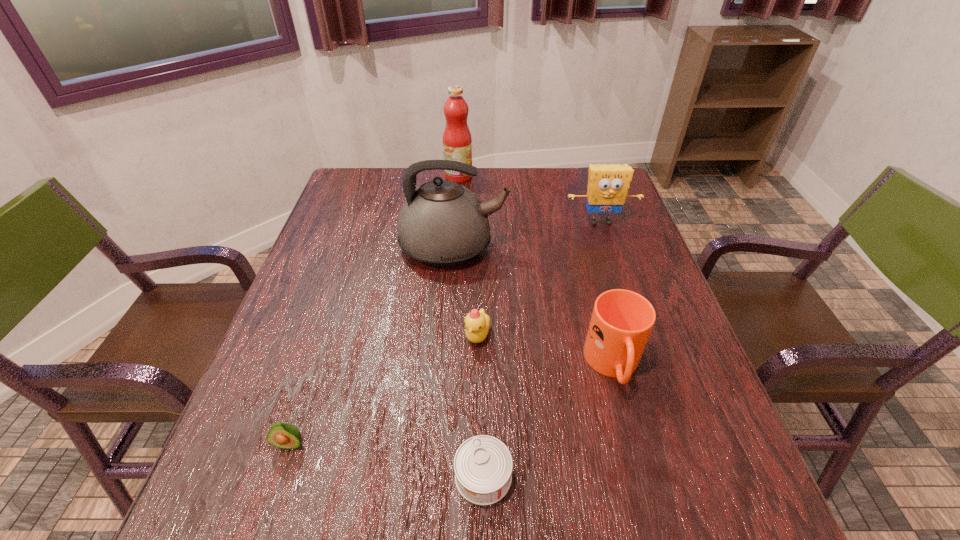
The height and width of the screenshot is (540, 960). I want to click on free region located 0.090m on the handle side of the mug, so click(635, 446).

The width and height of the screenshot is (960, 540). I want to click on vacant position located on the front-facing side of the duckling, so click(x=477, y=407).

Locate an element on the screen. Image resolution: width=960 pixels, height=540 pixels. vacant area situated 0.090m on the cut side of the avocado is located at coordinates (269, 508).

The height and width of the screenshot is (540, 960). Find the location of `vacant space located 0.120m on the right of the can`. vacant space located 0.120m on the right of the can is located at coordinates (583, 476).

Locate an element on the screen. Image resolution: width=960 pixels, height=540 pixels. object situated at the far edge is located at coordinates (457, 141).

The image size is (960, 540). In order to click on object that is at the near edge in this screenshot , I will do click(483, 465).

At what (x,y) coordinates should I click in order to perform the action: click on object present at the left edge. Please return your answer as a coordinate pair (x, y). Looking at the image, I should click on (283, 435).

Find the location of a particular element. The width and height of the screenshot is (960, 540). sponge present at the right edge is located at coordinates (608, 185).

Find the location of a particular element. This screenshot has width=960, height=540. mug that is at the right edge is located at coordinates (622, 320).

The image size is (960, 540). Identify the location of vacant space at the far edge of the desktop. (502, 188).